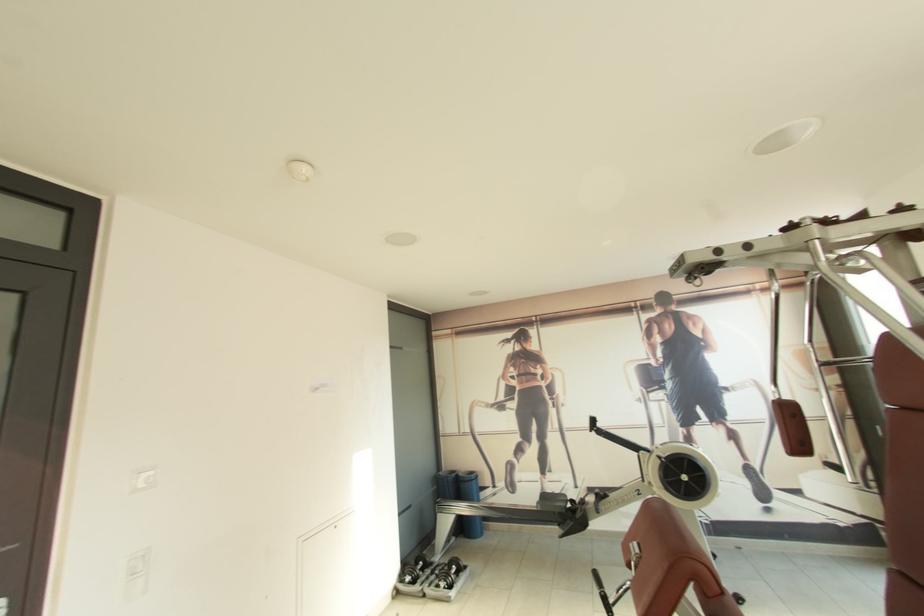
Identify the location of padded machine rest. (793, 428).